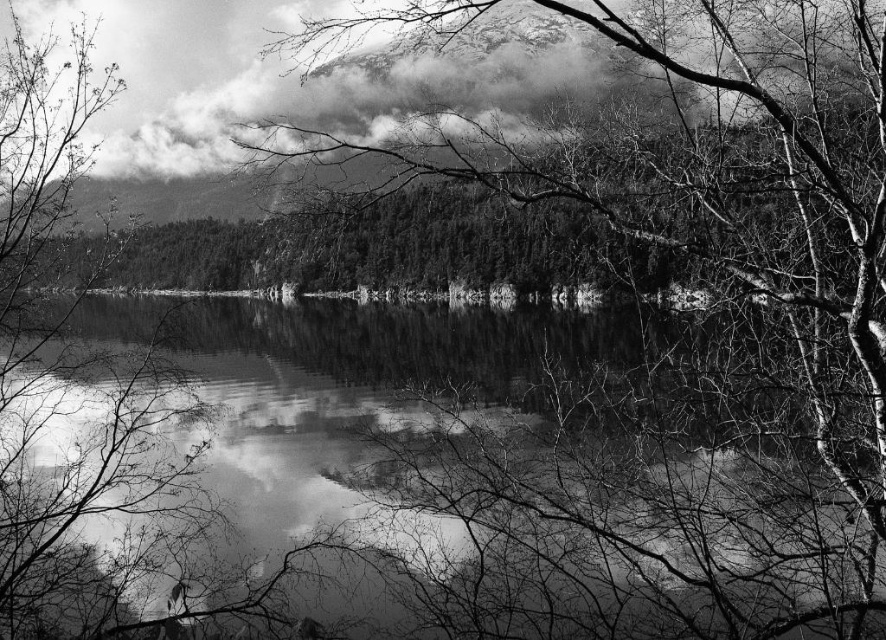
Based on the photo, you are standing at the edge of the serene natural landscape shown in the image. There is a point marked at coordinates (418, 474). Based on the scene description, where is this point located?

The point (418, 474) is on the smooth water at center.